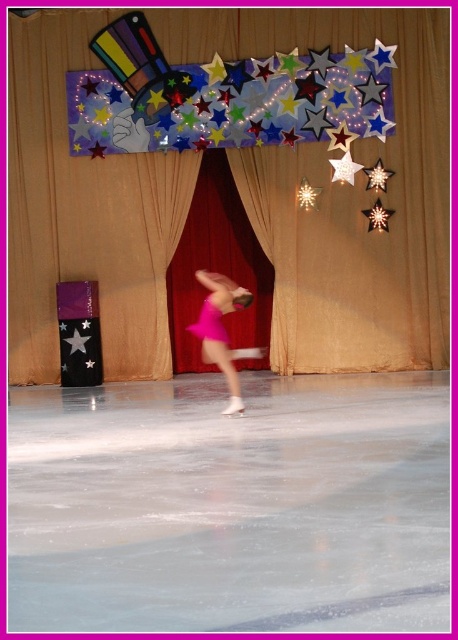
Between white ice skating rink at center and red velvet curtain at center, which one appears on the left side from the viewer's perspective?

red velvet curtain at center is more to the left.

Which is below, white ice skating rink at center or red velvet curtain at center?

white ice skating rink at center is below.

I want to click on white ice skating rink at center, so click(230, 506).

I want to click on white ice skating rink at center, so click(230, 506).

Who is more distant from viewer, (246, 301) or (201, 326)?

Positioned behind is point (201, 326).

Is pink satin skirt at center below pink satin dress at center?

Yes, pink satin skirt at center is below pink satin dress at center.

Does point (232, 289) lie behind point (207, 324)?

Yes, it is.

Where is `pink satin skirt at center`? Image resolution: width=458 pixels, height=640 pixels. pink satin skirt at center is located at coordinates (223, 332).

In the scene shown: Can you confirm if red velvet curtain at center is wider than pink satin dress at center?

Yes.

Does red velvet curtain at center have a greater height compared to pink satin dress at center?

Yes.

Does point (31, 378) come in front of point (196, 332)?

Yes, it is.

Identify the location of red velvet curtain at center. pos(345,193).